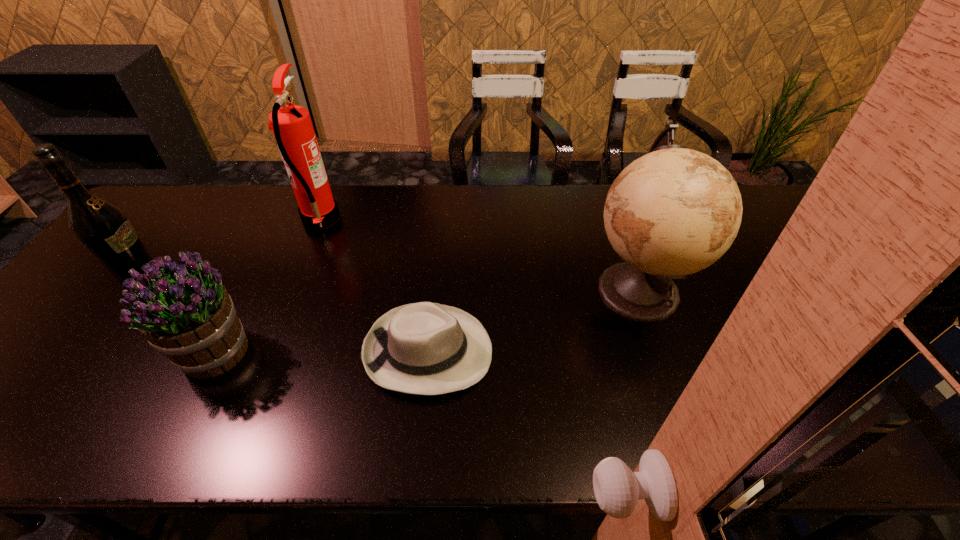
Image resolution: width=960 pixels, height=540 pixels. Identify the location of free space that satisfies the following two spatial constraints: 1. with the nozzle aimed from the farthest object; 2. on the front side of the fourth tallest object. click(267, 352).